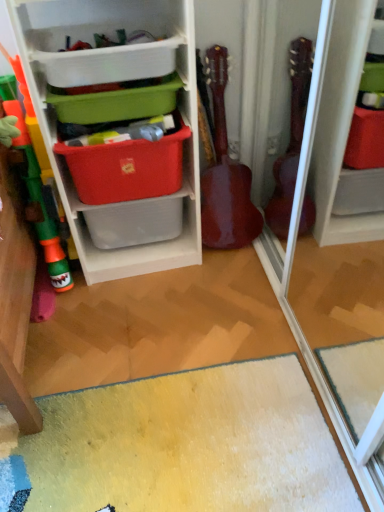
You are a GUI agent. You are given a task and a screenshot of the screen. Output one action in this format:
    pyautogui.click(x=<x>, y=<y>)
    Task: Click on the vacant space in front of glossy wood guitar at center
    
    Given the screenshot: What is the action you would take?
    pyautogui.click(x=236, y=268)